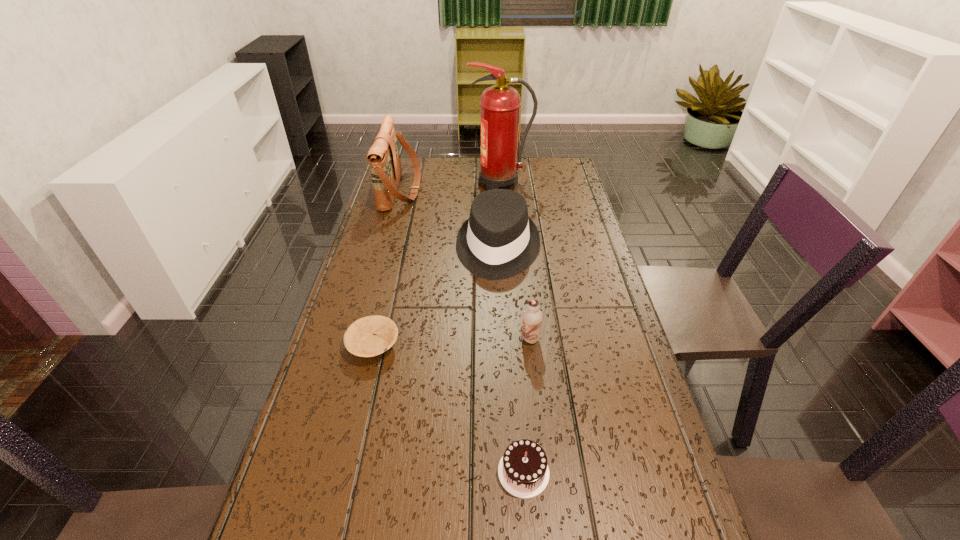
I want to click on object located at the far left corner, so 384,158.

The width and height of the screenshot is (960, 540). Find the location of `free location at the far edge`. free location at the far edge is located at coordinates (433, 173).

In the image, there is a desktop. Where is `free region at the left edge`? free region at the left edge is located at coordinates (354, 477).

The image size is (960, 540). In order to click on vacant space at the right edge of the desktop in this screenshot , I will do `click(600, 333)`.

Image resolution: width=960 pixels, height=540 pixels. I want to click on free point between the tallest object and the nearest object, so click(x=512, y=328).

You are a GUI agent. You are given a task and a screenshot of the screen. Output one action in this format:
    pyautogui.click(x=<x>, y=<y>)
    Task: Click on the vacant space that's between the shortest object and the fedora
    
    Given the screenshot: What is the action you would take?
    pyautogui.click(x=436, y=297)

Locate an element on the screen. The height and width of the screenshot is (540, 960). empty space between the second tallest object and the tallest object is located at coordinates (450, 187).

In order to click on vacant space that's between the fourth shortest object and the shoulder bag in this screenshot , I will do `click(449, 219)`.

Locate an element on the screen. The image size is (960, 540). vacant space that's between the third tallest object and the nearest object is located at coordinates (511, 360).

Image resolution: width=960 pixels, height=540 pixels. What are the coordinates of `free area in between the chocolate milk and the nearest object` in the screenshot? It's located at (527, 406).